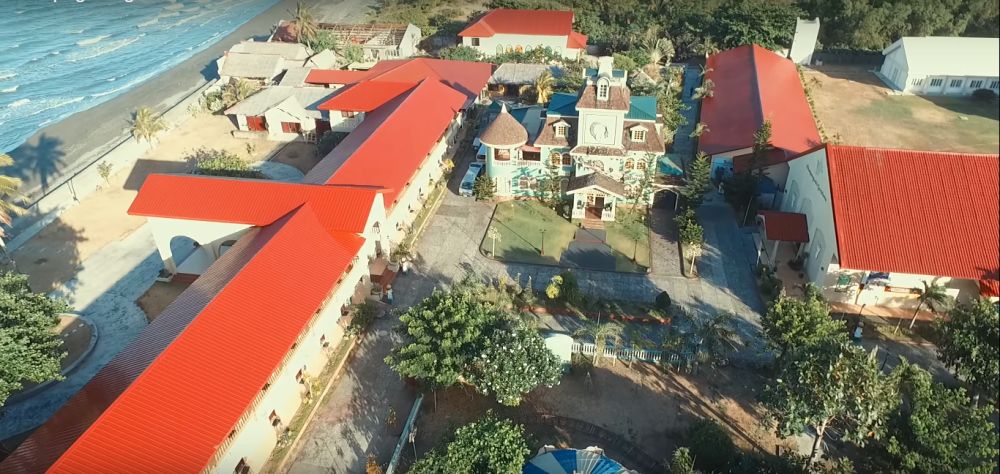
Locate an element on the screen. This screenshot has width=1000, height=474. red door is located at coordinates (320, 123), (292, 131), (254, 123).